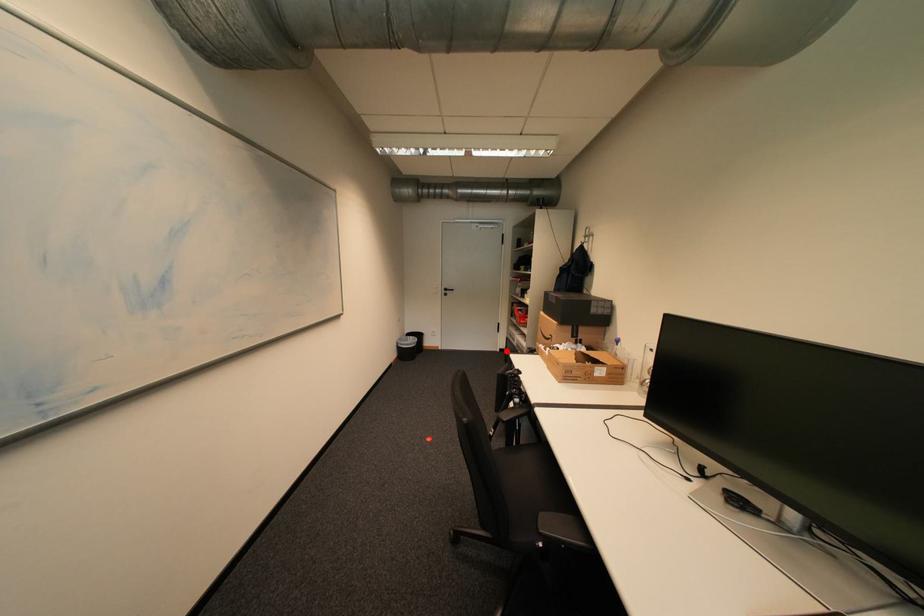
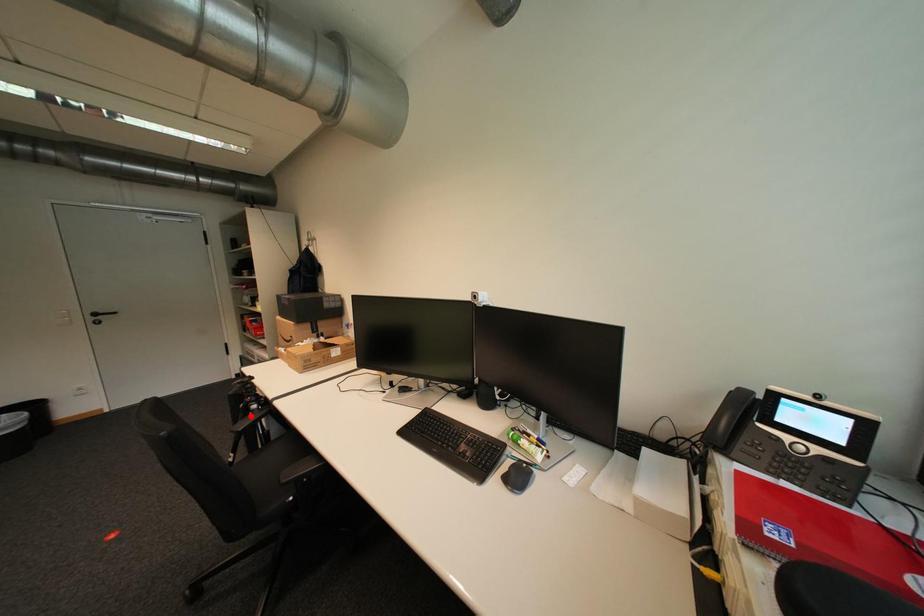
I am providing you with two images of the same scene from different viewpoints. A red point is marked on the first image and another point is marked on the second image. Do the highlighted points in image1 and image2 indicate the same real-world spot?

No